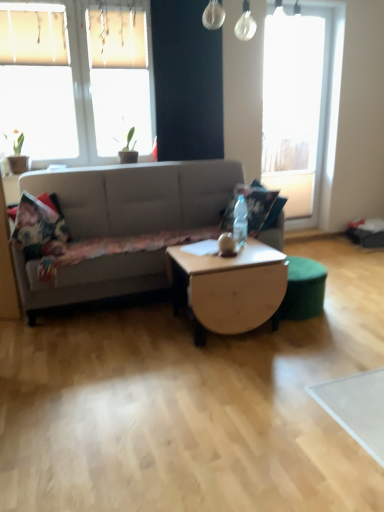
At what (x,y) coordinates should I click in order to perform the action: click on free space in front of matte gray studio couch at center. Please return your answer as a coordinate pair (x, y). This screenshot has width=384, height=512. Looking at the image, I should click on coord(163,388).